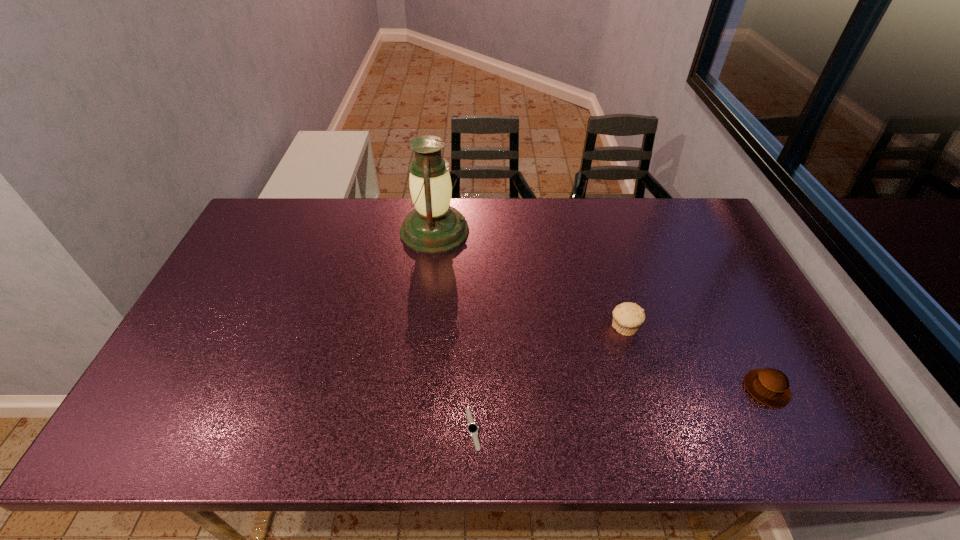
Locate an element on the screen. The image size is (960, 540). the tallest object is located at coordinates (434, 226).

Identify the location of the leftmost object. This screenshot has width=960, height=540. (434, 226).

I want to click on the left muffin, so click(627, 317).

Find the location of a particular element. The height and width of the screenshot is (540, 960). the second object from right to left is located at coordinates (627, 317).

This screenshot has height=540, width=960. I want to click on the rightmost object, so click(x=769, y=386).

The height and width of the screenshot is (540, 960). What are the coordinates of `the second shortest object` in the screenshot? It's located at (769, 386).

Where is `the shortest object`? The height and width of the screenshot is (540, 960). the shortest object is located at coordinates (472, 428).

This screenshot has width=960, height=540. I want to click on the nearest object, so click(472, 428).

Locate an element on the screen. This screenshot has height=540, width=960. blank area located 0.160m with the light compartment facing forward on the lantern is located at coordinates (516, 231).

Identify the location of free space located 0.220m on the right of the taller muffin. This screenshot has width=960, height=540. (719, 328).